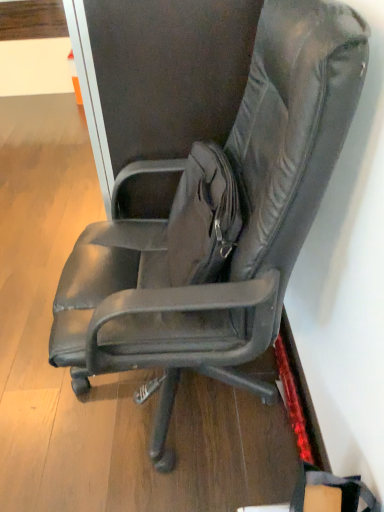
This screenshot has width=384, height=512. In order to click on black leather shoulder bag at center in this screenshot , I will do tap(333, 487).

Consider the image. What is the approximate height of black leather shoulder bag at center?

black leather shoulder bag at center is 8.36 inches tall.

Measure the distance between black leather shoulder bag at center and camera.

black leather shoulder bag at center is 33.39 inches from camera.

Image resolution: width=384 pixels, height=512 pixels. Describe the element at coordinates (333, 487) in the screenshot. I see `black leather shoulder bag at center` at that location.

Locate an element on the screen. This screenshot has height=512, width=384. black leather shoulder bag at center is located at coordinates (333, 487).